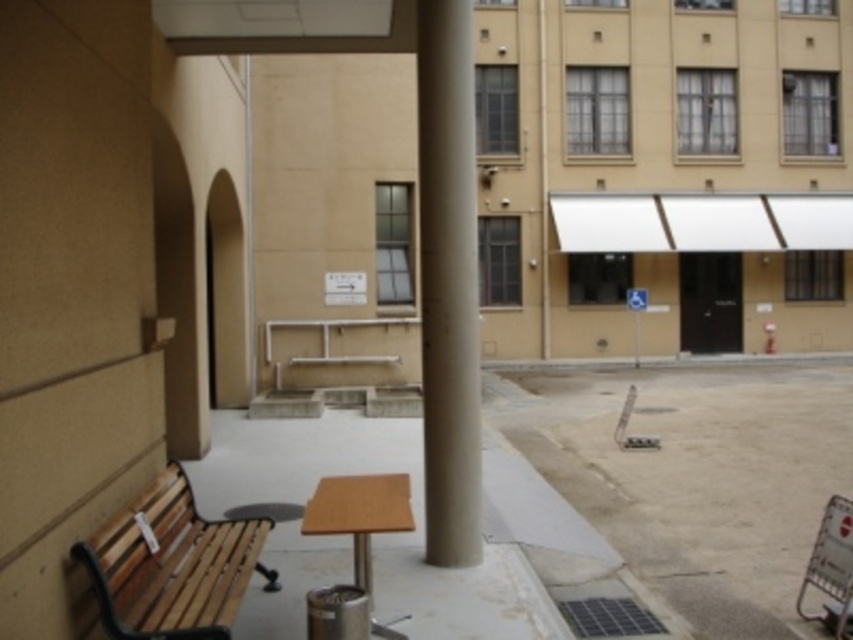
Who is shorter, smooth concrete pillar at center or wooden park bench at lower left?

wooden park bench at lower left is shorter.

Between point (465, 285) and point (165, 531), which one is positioned behind?

Point (465, 285)

You are a GUI agent. You are given a task and a screenshot of the screen. Output one action in this format:
    pyautogui.click(x=<x>, y=<y>)
    Task: Click on the smooth concrete pillar at center
    This screenshot has height=640, width=853.
    Given the screenshot: What is the action you would take?
    pyautogui.click(x=448, y=282)

Can you confirm if smooth concrete pavement at center is taller than wooden table at center?

In fact, smooth concrete pavement at center may be shorter than wooden table at center.

Is point (792, 577) positioned in front of point (369, 500)?

No, it is not.

Based on the photo, measure the distance between smooth concrete pavement at center and camera.

smooth concrete pavement at center and camera are 4.38 meters apart.

Identify the location of smooth concrete pavement at center. This screenshot has height=640, width=853. (697, 476).

Does smooth concrete pavement at center appear on the left side of smooth concrete pillar at center?

Incorrect, smooth concrete pavement at center is not on the left side of smooth concrete pillar at center.

Describe the element at coordinates (697, 476) in the screenshot. I see `smooth concrete pavement at center` at that location.

Locate an element on the screen. This screenshot has height=640, width=853. smooth concrete pavement at center is located at coordinates (697, 476).

Identify the location of smooth concrete pavement at center. (697, 476).